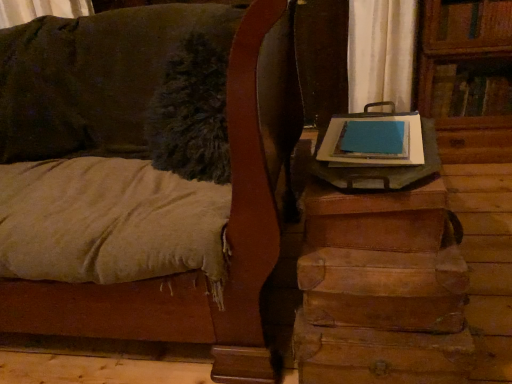
In order to click on wooden trunk at right in this screenshot , I will do [226, 228].

Measure the distance between wooden trunk at right and camera.

A distance of 27.89 inches exists between wooden trunk at right and camera.

Describe the element at coordinates (226, 228) in the screenshot. I see `wooden trunk at right` at that location.

What do you see at coordinates (382, 289) in the screenshot?
I see `brown leather suitcase at lower right` at bounding box center [382, 289].

At what (x,y) coordinates should I click in order to perform the action: click on brown leather suitcase at lower right. Please return your answer as a coordinate pair (x, y). This screenshot has width=512, height=384. Looking at the image, I should click on (382, 289).

Where is `wooden trunk at right`? The image size is (512, 384). wooden trunk at right is located at coordinates (226, 228).

Looking at this image, between brown leather suitcase at lower right and wooden trunk at right, which one appears on the left side from the viewer's perspective?

Positioned to the left is wooden trunk at right.

Is brown leather suitcase at lower right in front of or behind wooden trunk at right in the image?

Visually, brown leather suitcase at lower right is located behind wooden trunk at right.

Between point (444, 299) and point (250, 108), which one is positioned in front?

The point (250, 108) is closer to the camera.

From the image's perspective, relative to wooden trunk at right, is brown leather suitcase at lower right above or below?

Clearly, from the image's perspective, brown leather suitcase at lower right is below wooden trunk at right.

From a real-world perspective, between brown leather suitcase at lower right and wooden trunk at right, who is vertically lower?

brown leather suitcase at lower right is physically lower.

Looking at their sizes, would you say brown leather suitcase at lower right is wider or thinner than wooden trunk at right?

In the image, brown leather suitcase at lower right appears to be more narrow than wooden trunk at right.

Considering the relative sizes of brown leather suitcase at lower right and wooden trunk at right in the image provided, is brown leather suitcase at lower right shorter than wooden trunk at right?

Indeed, brown leather suitcase at lower right has a lesser height compared to wooden trunk at right.

Considering the sizes of objects brown leather suitcase at lower right and wooden trunk at right in the image provided, who is bigger, brown leather suitcase at lower right or wooden trunk at right?

wooden trunk at right is bigger.

Is brown leather suitcase at lower right positioned beyond the bounds of wooden trunk at right?

brown leather suitcase at lower right is positioned outside wooden trunk at right.

Is brown leather suitcase at lower right far away from wooden trunk at right?

They are positioned close to each other.

Is brown leather suitcase at lower right oriented towards wooden trunk at right?

No, brown leather suitcase at lower right is not oriented towards wooden trunk at right.

From the picture: How many degrees apart are the facing directions of brown leather suitcase at lower right and wooden trunk at right?

The angle between the facing direction of brown leather suitcase at lower right and the facing direction of wooden trunk at right is 5.11 degrees.

Find the location of `furniture above the brown leather suitcase at lower right (from a real-world perspective)`. furniture above the brown leather suitcase at lower right (from a real-world perspective) is located at coordinates (226, 228).

Is wooden trunk at right to the right of brown leather suitcase at lower right from the viewer's perspective?

No, wooden trunk at right is not to the right of brown leather suitcase at lower right.

Is wooden trunk at right behind brown leather suitcase at lower right?

No, it is not.

Is point (130, 135) farther from camera compared to point (324, 369)?

Yes, point (130, 135) is farther from viewer.

From the image's perspective, is wooden trunk at right under brown leather suitcase at lower right?

No.

From a real-world perspective, which is physically above, wooden trunk at right or brown leather suitcase at lower right?

From a 3D spatial view, wooden trunk at right is above.

Is wooden trunk at right wider or thinner than brown leather suitcase at lower right?

In the image, wooden trunk at right appears to be wider than brown leather suitcase at lower right.

Can you confirm if wooden trunk at right is shorter than brown leather suitcase at lower right?

No, wooden trunk at right is not shorter than brown leather suitcase at lower right.

Is wooden trunk at right smaller than brown leather suitcase at lower right?

Incorrect, wooden trunk at right is not smaller in size than brown leather suitcase at lower right.

Is wooden trunk at right spatially inside brown leather suitcase at lower right, or outside of it?

wooden trunk at right is outside brown leather suitcase at lower right.

Is the surface of wooden trunk at right in direct contact with brown leather suitcase at lower right?

No, wooden trunk at right is not in contact with brown leather suitcase at lower right.

Is wooden trunk at right facing away from brown leather suitcase at lower right?

No, brown leather suitcase at lower right is not at the back of wooden trunk at right.

Measure the distance from wooden trunk at right to brown leather suitcase at lower right.

They are 30.21 centimeters apart.

This screenshot has width=512, height=384. Find the location of `table below the wooden trunk at right (from a real-world perspective)`. table below the wooden trunk at right (from a real-world perspective) is located at coordinates (382, 289).

Locate an element on the screen. furniture in front of the brown leather suitcase at lower right is located at coordinates (226, 228).

At what (x,y) coordinates should I click in order to perform the action: click on furniture above the brown leather suitcase at lower right (from the image's perspective). Please return your answer as a coordinate pair (x, y). The width and height of the screenshot is (512, 384). Looking at the image, I should click on (226, 228).